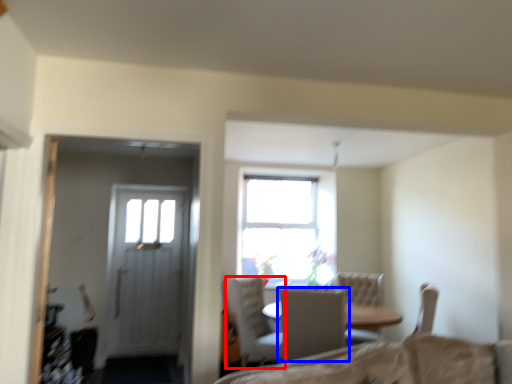
Question: Which object is further to the camera taking this photo, chair (highlighted by a red box) or chair (highlighted by a blue box)?

Choices:
 (A) chair
 (B) chair

Answer: (A)